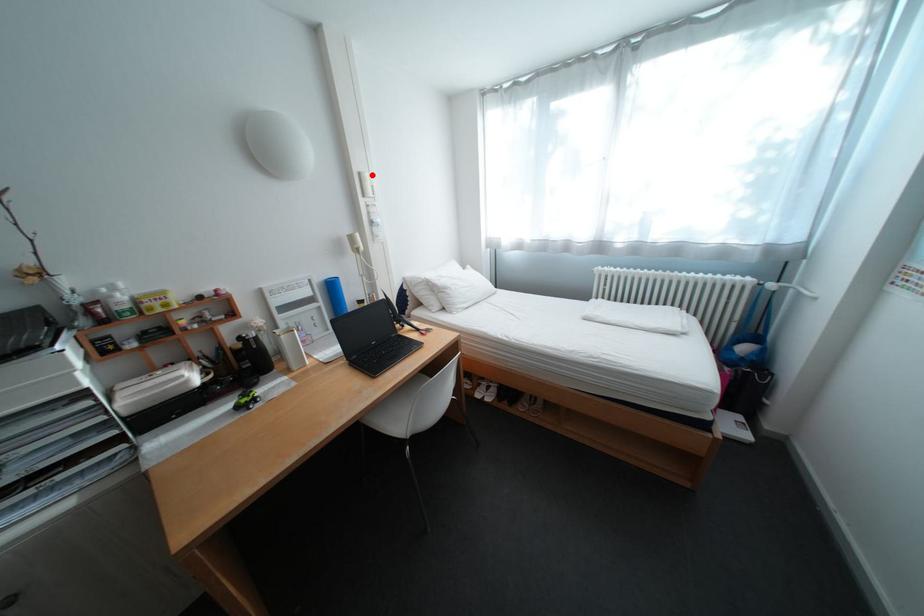
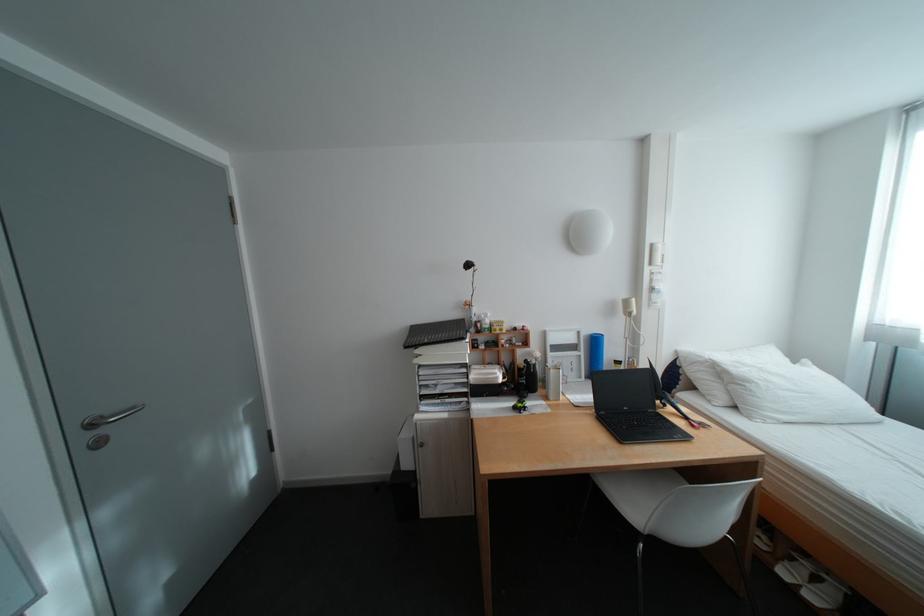
Question: I am providing you with two images of the same scene from different viewpoints. Image1 has a red point marked. In image2, the corresponding 3D location appears at what relative position? Reply with the corresponding letter.

Choices:
 (A) Closer
 (B) Farther

Answer: (B)